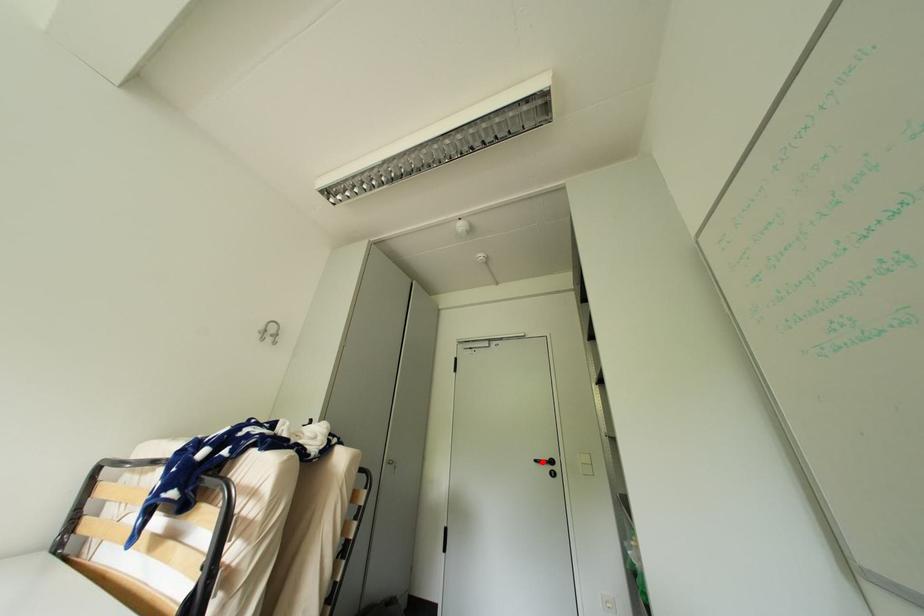
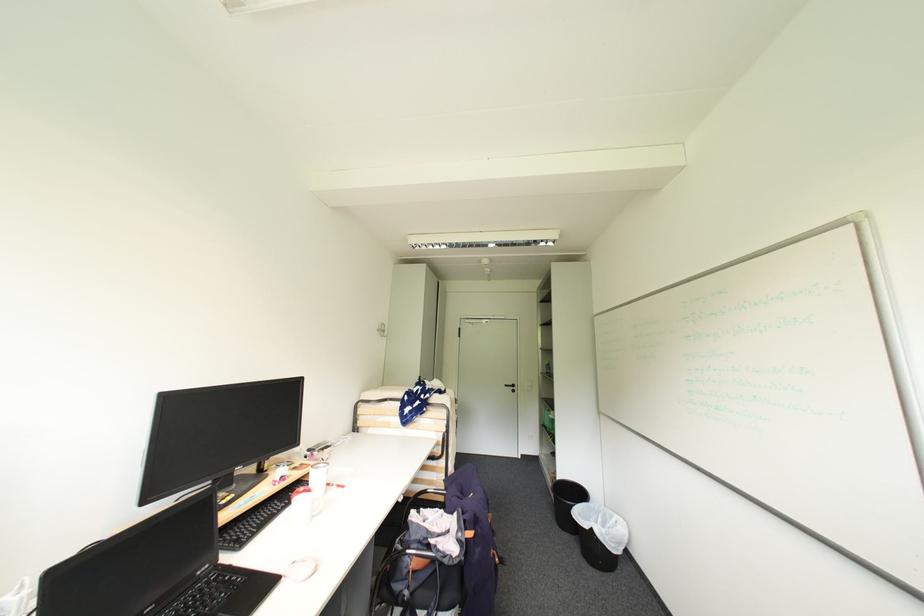
The point at the highlighted location is marked in the first image. Where is the corresponding point in the second image?

(513, 387)